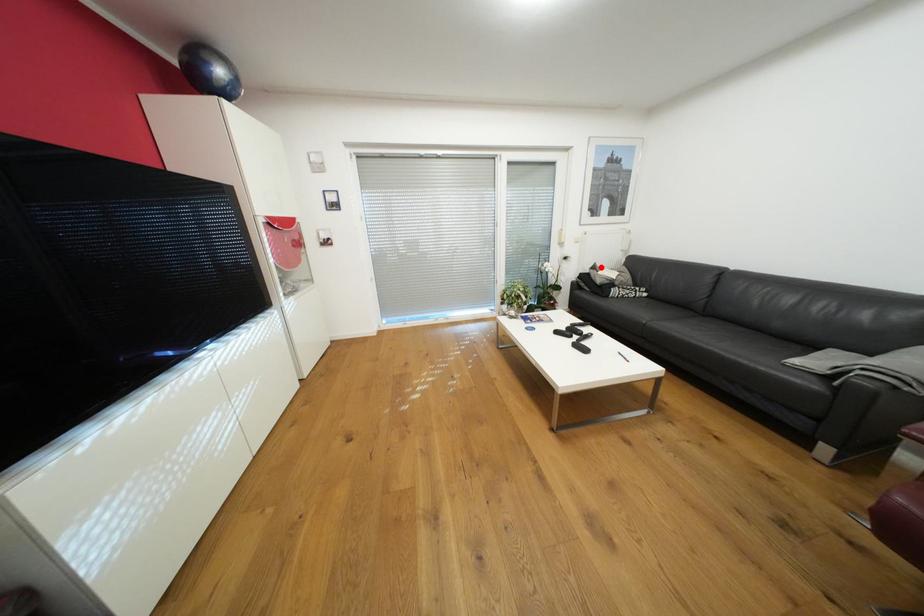
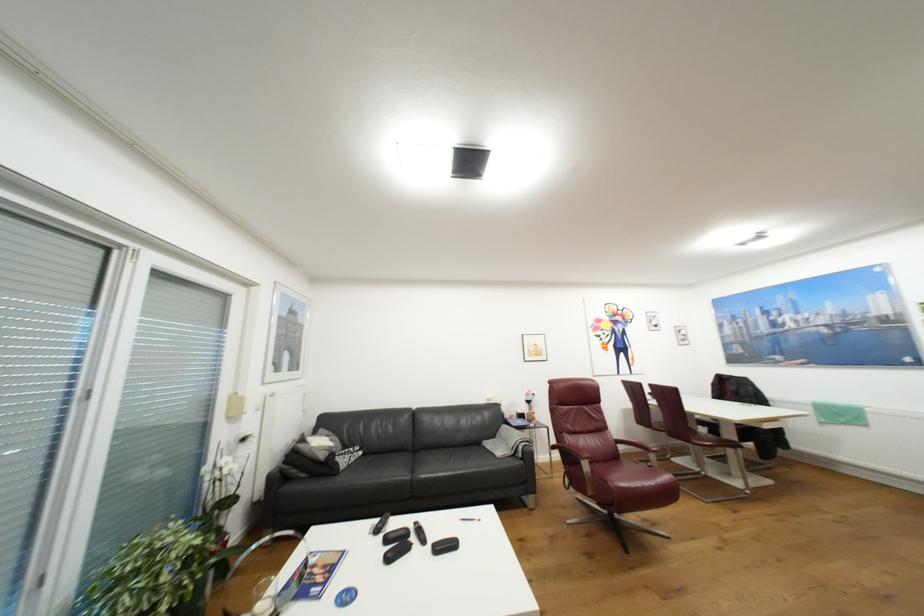
Where in the second image is the point corresponding to the highlighted location from the first image?

(309, 440)